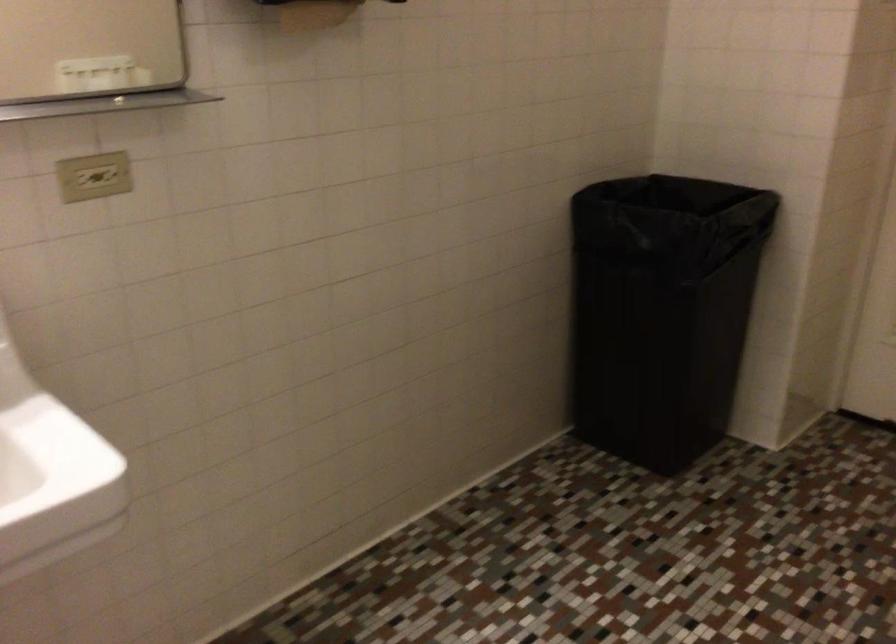
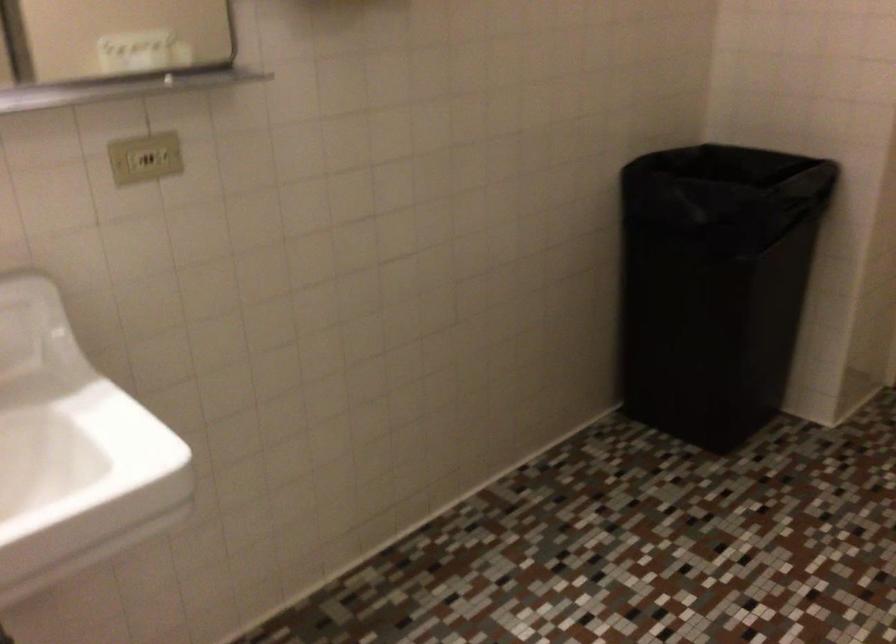
Question: The camera is either moving clockwise (left) or counter-clockwise (right) around the object. The first image is from the beginning of the video and the second image is from the end. Is the camera moving left or right when shooting the video?

Choices:
 (A) Left
 (B) Right

Answer: (B)